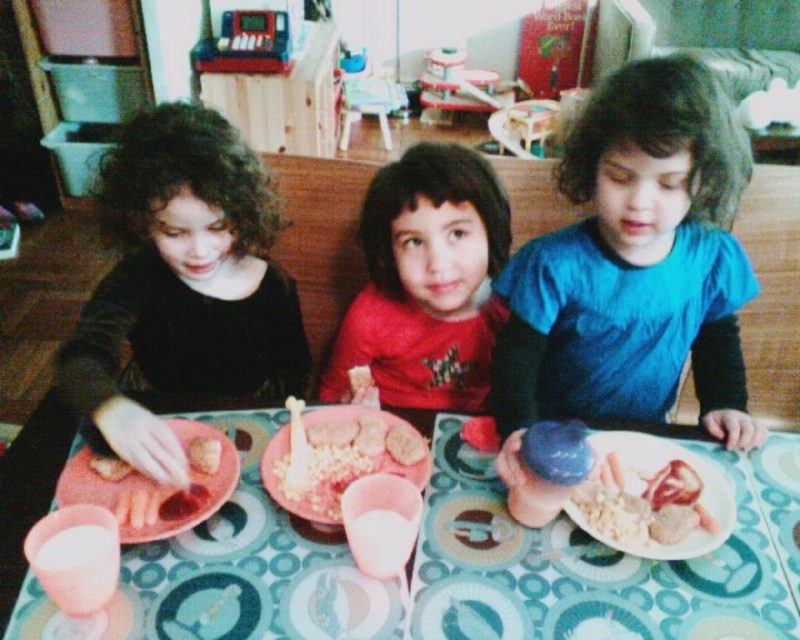
Question: Is smooth white bread at center smaller than pink matte plastic fork at lower left?

Choices:
 (A) yes
 (B) no

Answer: (B)

Question: Is red matte shirt at center below yellowish matte rice at center?

Choices:
 (A) no
 (B) yes

Answer: (A)

Question: Considering the real-world distances, which object is closest to the patterned plastic table at center?

Choices:
 (A) red matte shirt at center
 (B) blue matte shirt at center
 (C) smooth matte tomato at center

Answer: (C)

Question: Which of the following is the closest to the observer?

Choices:
 (A) red matte shirt at center
 (B) smooth white bread at center

Answer: (B)

Question: In this image, where is yellowish matte rice at center located relative to brown crumbly bread at center?

Choices:
 (A) below
 (B) above

Answer: (A)

Question: Which of the following is the farthest from the observer?

Choices:
 (A) red matte shirt at center
 (B) smooth matte tomato at center
 (C) pink matte plate at lower left
 (D) matte black shirt at left

Answer: (B)